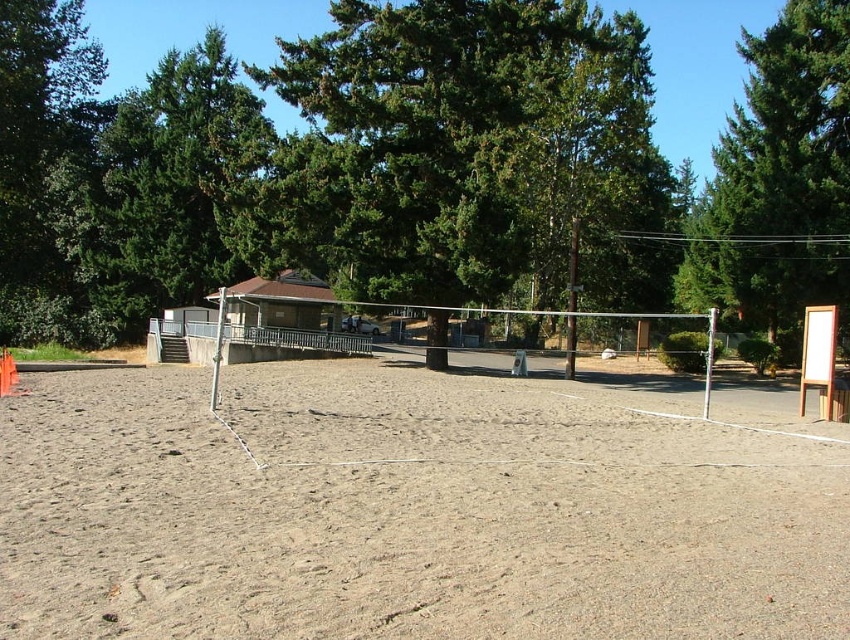
Does brown sandy beach at center appear under green textured tree at upper right?

Correct, brown sandy beach at center is located below green textured tree at upper right.

Which is in front, point (144, 556) or point (837, 8)?

Point (144, 556) is more forward.

At what (x,y) coordinates should I click in order to perform the action: click on brown sandy beach at center. Please return your answer as a coordinate pair (x, y). The height and width of the screenshot is (640, 850). Looking at the image, I should click on (404, 513).

Based on the photo, does brown sandy beach at center have a larger size compared to green leafy tree at center?

Incorrect, brown sandy beach at center is not larger than green leafy tree at center.

Which of these two, brown sandy beach at center or green leafy tree at center, stands taller?

green leafy tree at center is taller.

Between point (506, 573) and point (612, 164), which one is positioned behind?

The point (612, 164) is behind.

Find the location of a particular element. brown sandy beach at center is located at coordinates (404, 513).

Does green leafy tree at center appear under green textured tree at upper right?

Incorrect, green leafy tree at center is not positioned below green textured tree at upper right.

Is green leafy tree at center taller than green textured tree at upper right?

Indeed, green leafy tree at center has a greater height compared to green textured tree at upper right.

Measure the distance between point [570,204] and camera.

A distance of 53.15 meters exists between point [570,204] and camera.

Find the location of a particular element. green leafy tree at center is located at coordinates (460, 152).